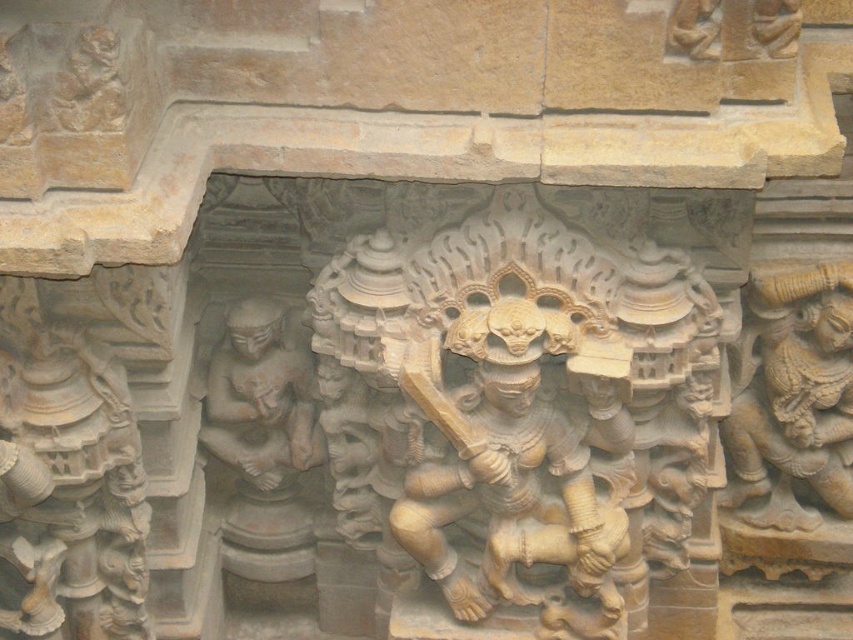
Is beige stone warrior at center thinner than smooth stone figure at center?

No, beige stone warrior at center is not thinner than smooth stone figure at center.

Can you confirm if beige stone warrior at center is positioned to the right of smooth stone figure at center?

Correct, you'll find beige stone warrior at center to the right of smooth stone figure at center.

Which is in front, point (496, 488) or point (281, 307)?

Point (496, 488) is in front.

The width and height of the screenshot is (853, 640). I want to click on beige stone warrior at center, so click(x=517, y=458).

Which is above, golden stone warrior at center or carved stone figure at right?

carved stone figure at right is higher up.

Between golden stone warrior at center and carved stone figure at right, which one appears on the left side from the viewer's perspective?

golden stone warrior at center

What do you see at coordinates (517, 410) in the screenshot? This screenshot has width=853, height=640. I see `golden stone warrior at center` at bounding box center [517, 410].

Locate an element on the screen. This screenshot has height=640, width=853. golden stone warrior at center is located at coordinates (517, 410).

Who is positioned more to the right, golden stone warrior at center or beige stone warrior at center?

From the viewer's perspective, golden stone warrior at center appears more on the right side.

Between golden stone warrior at center and beige stone warrior at center, which one has less height?

With less height is beige stone warrior at center.

Does point (540, 525) lie behind point (428, 547)?

Yes.

Find the location of a particular element. The height and width of the screenshot is (640, 853). golden stone warrior at center is located at coordinates (517, 410).